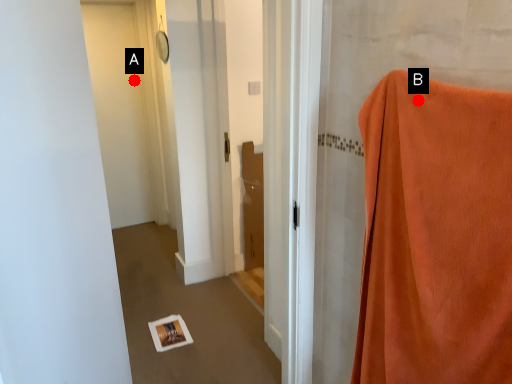
Question: Two points are circled on the image, labeled by A and B beside each circle. Which of the following is the farthest from the observer?

Choices:
 (A) A is further
 (B) B is further

Answer: (A)